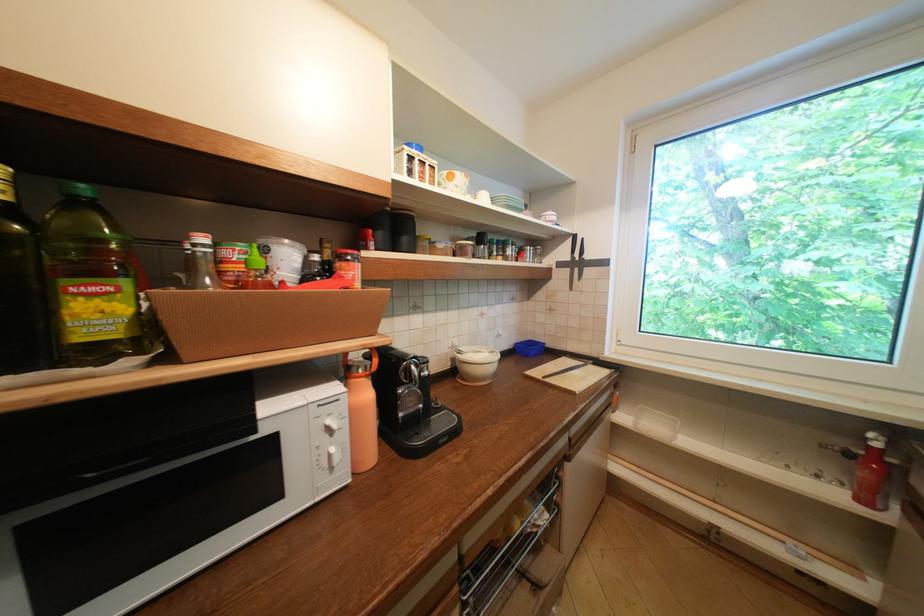
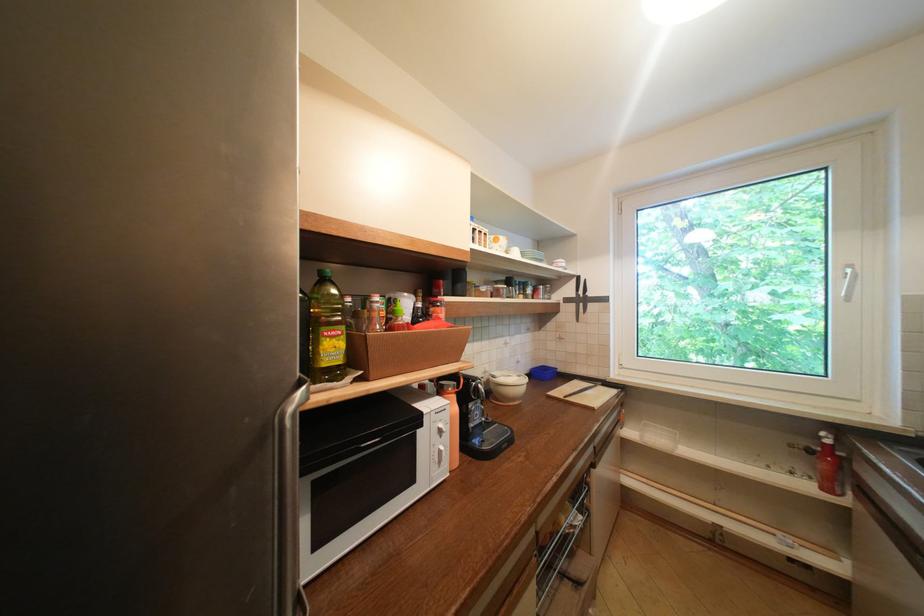
In the second image, find the point that corresponds to (x=110, y=291) in the first image.

(345, 334)